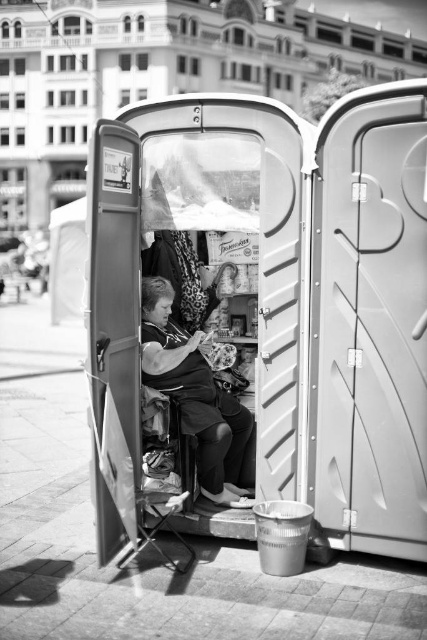
Can you confirm if plastic portable toilet at center is thinner than matte black fabric woman at center?

No.

Between plastic portable toilet at center and matte black fabric woman at center, which one is positioned lower?

matte black fabric woman at center is lower down.

Locate an element on the screen. The width and height of the screenshot is (427, 640). plastic portable toilet at center is located at coordinates (287, 298).